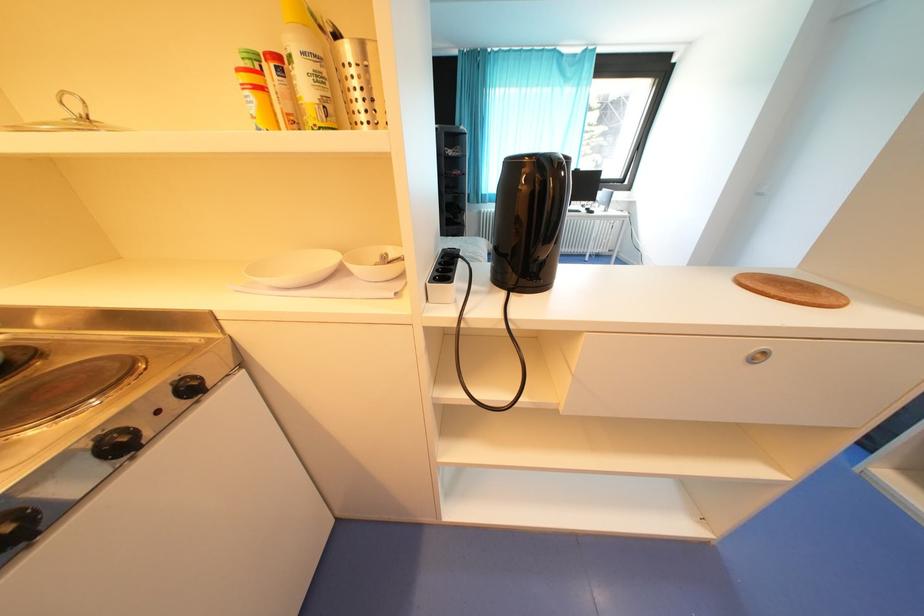
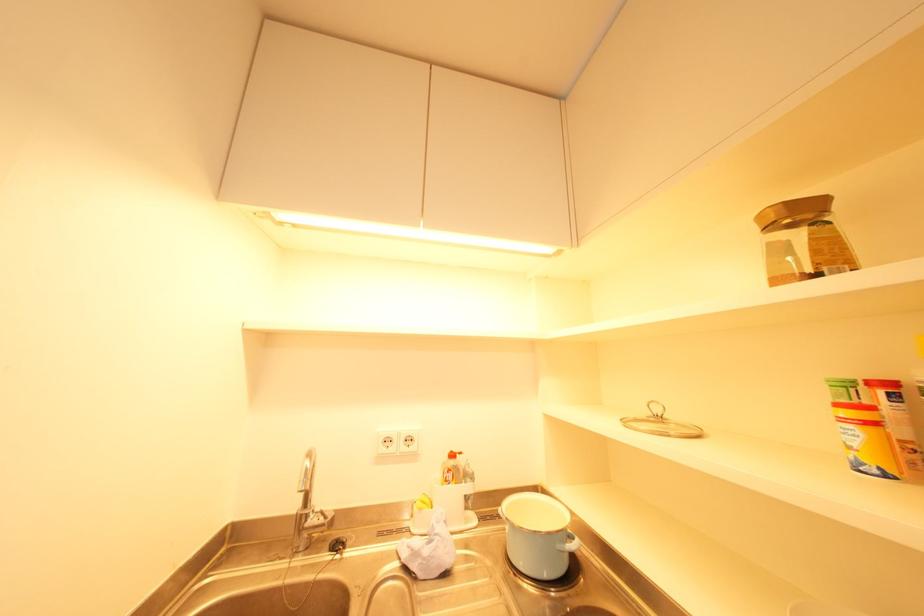
How did the camera likely rotate?

The camera's rotation is toward left-up.